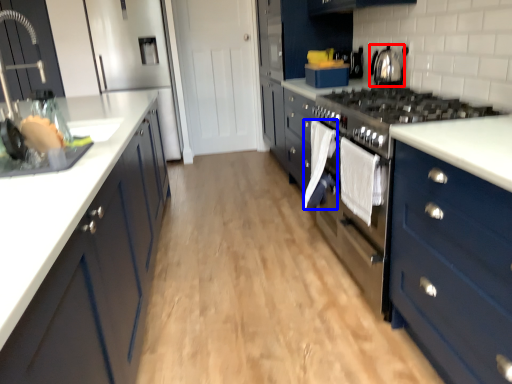
Question: Which object appears farthest to the camera in this image, home appliance (highlighted by a red box) or clothe (highlighted by a blue box)?

Choices:
 (A) home appliance
 (B) clothe

Answer: (A)